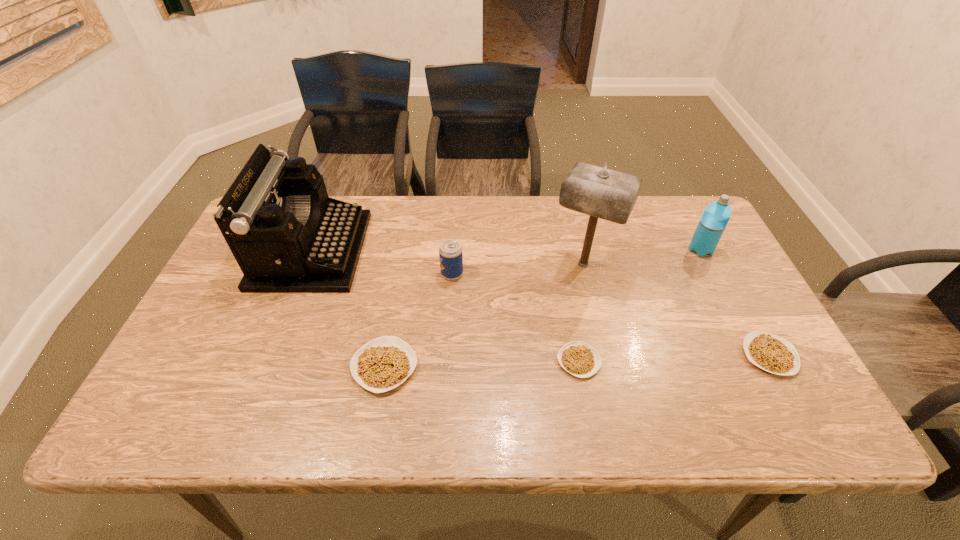
Identify which object is located as the fourth nearest to the third tallest object. Please provide its 2D coordinates. Your answer should be formatted as a tuple, i.e. [(x, y)], where the tuple contains the x and y coordinates of a point satisfying the conditions above.

[(450, 251)]

Select which object appears as the fourth closest to the shortest object. Please provide its 2D coordinates. Your answer should be formatted as a tuple, i.e. [(x, y)], where the tuple contains the x and y coordinates of a point satisfying the conditions above.

[(769, 352)]

Find the location of a particular element. legume that can be found as the third closest to the sixth shortest object is located at coordinates pos(769,352).

Find the location of a particular element. legume that is the third closest one to the thermos bottle is located at coordinates (384, 363).

Find the location of a particular element. The image size is (960, 540). vacant area in the image that satisfies the following two spatial constraints: 1. on the typing side of the leftmost object; 2. on the back side of the tallest legume is located at coordinates point(266,367).

Image resolution: width=960 pixels, height=540 pixels. What are the coordinates of `free spot that satisfies the following two spatial constraints: 1. on the back side of the sixth object from right to left; 2. on the typing side of the typewriter` in the screenshot? It's located at (405, 251).

Image resolution: width=960 pixels, height=540 pixels. I want to click on free spot that satisfies the following two spatial constraints: 1. on the back side of the fifth shortest object; 2. on the right side of the fifth object from right to left, so click(x=454, y=250).

At what (x,y) coordinates should I click in order to perform the action: click on vacant region that satisfies the following two spatial constraints: 1. on the typing side of the second tallest object; 2. on the left side of the tallest object. Please return your answer as a coordinate pair (x, y). The height and width of the screenshot is (540, 960). Looking at the image, I should click on (306, 265).

The width and height of the screenshot is (960, 540). What are the coordinates of `free point that satisfies the following two spatial constraints: 1. on the typing side of the second shortest object; 2. on the right side of the leftmost object` in the screenshot? It's located at (271, 356).

Find the location of a particular element. free space that satisfies the following two spatial constraints: 1. on the typing side of the sixth shortest object; 2. on the left side of the shortest object is located at coordinates (269, 361).